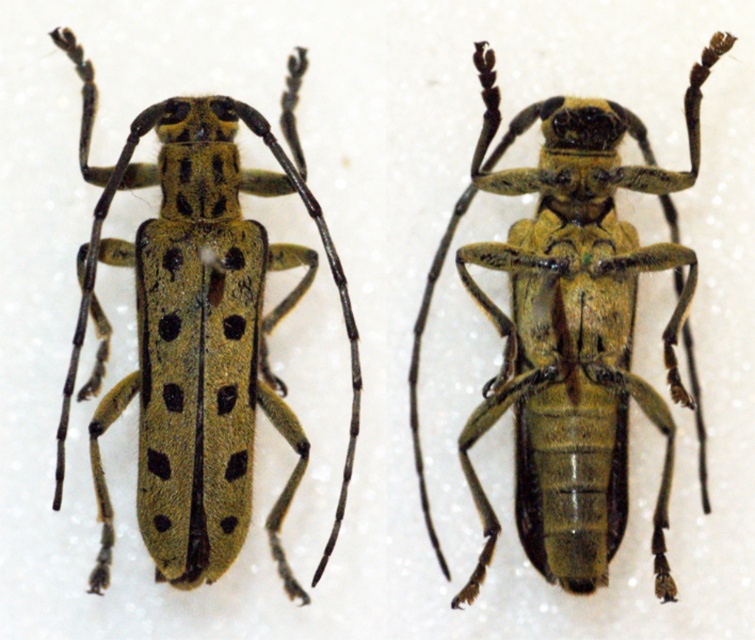
You are an entomologist examining two beetles in the image. Both are positioned at the center but one is slightly shorter. Which beetle is shorter between the green matte beetle at center and the green textured beetle at center?

The green matte beetle at center is not as tall as the green textured beetle at center, so the green matte beetle at center is shorter.

You are an entomologist examining two longhorn beetles side by side on a white background. You notice a green matte beetle at center marked by point [572,332]. Can you determine the spatial relationship between this beetle and the other beetle not marked by a point?

The green matte beetle at center is represented by point [572,332], so the other beetle not marked by a point is positioned to the left or right of it depending on the coordinate system, but without additional data, the exact position cannot be determined.

You are standing 2 meters away from a white background with two beetles. There is a point at coordinates point (532, 260). Can you reach this point without moving closer than 1.41 meters to it?

The point at coordinates point (532, 260) is 1.41 meters from the camera. Since you are standing 2 meters away from the background, you are already farther than the required 1.41 meters. Therefore, you can reach this point without moving closer than 1.41 meters to it.